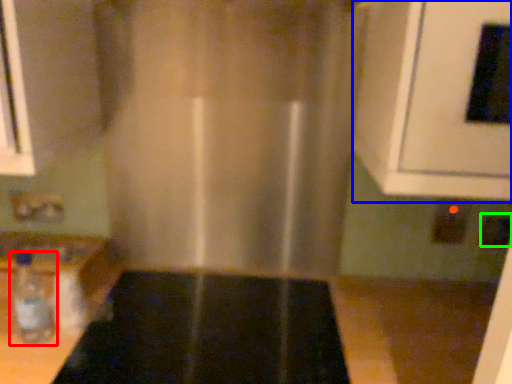
Question: Estimate the real-world distances between objects in this image. Which object is farther from bottle (highlighted by a red box), oven (highlighted by a blue box) or electric outlet (highlighted by a green box)?

Choices:
 (A) oven
 (B) electric outlet

Answer: (B)